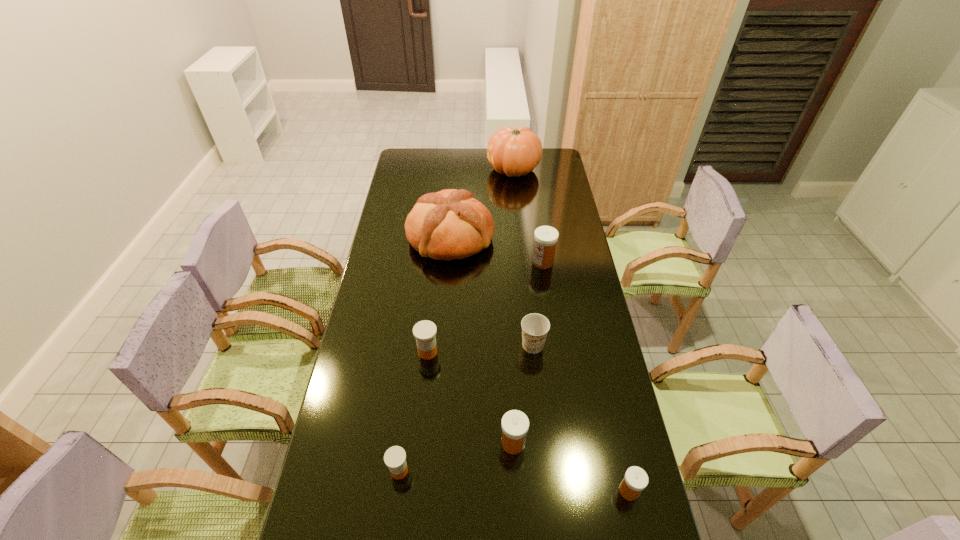
Where is `the farthest object`? The image size is (960, 540). the farthest object is located at coordinates (515, 152).

Find the location of `bread`. bread is located at coordinates (450, 224).

Where is `the biggest white medicine`? This screenshot has width=960, height=540. the biggest white medicine is located at coordinates (546, 237).

Where is `the fourth medicine from left to right`? the fourth medicine from left to right is located at coordinates (546, 237).

This screenshot has width=960, height=540. Find the location of `the farther orange medicine`. the farther orange medicine is located at coordinates (424, 331).

Where is `the bigger orange medicine`? The image size is (960, 540). the bigger orange medicine is located at coordinates (424, 331).

Locate an element on the screen. This screenshot has width=960, height=540. the second biggest white medicine is located at coordinates (515, 424).

What are the coordinates of `the second nearest white medicine` in the screenshot? It's located at (515, 424).

The image size is (960, 540). I want to click on orange Dixie cup, so click(535, 327).

This screenshot has width=960, height=540. What are the coordinates of `the smaller orange medicine` in the screenshot? It's located at (395, 457).